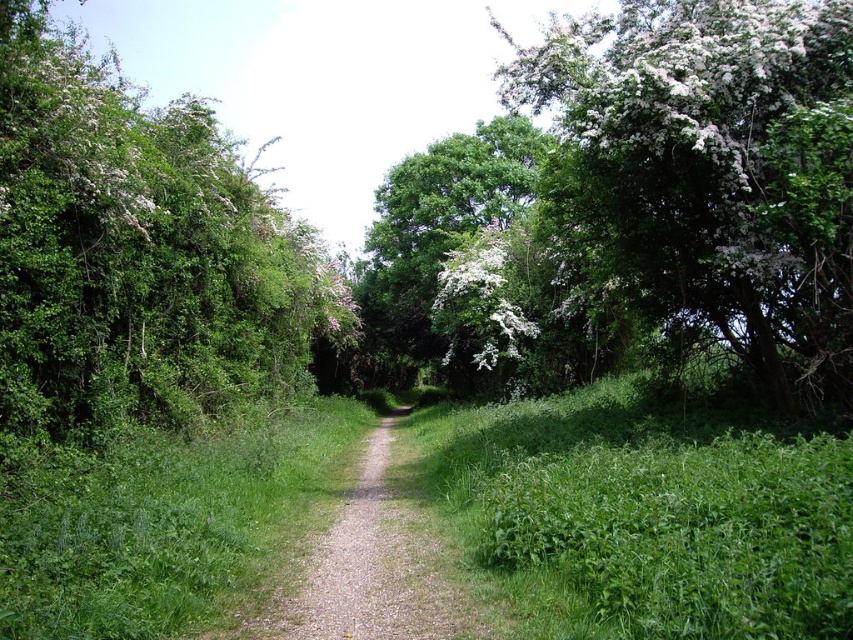
Does gravel path at center have a smaller size compared to green leafy tree at center?

Correct, gravel path at center occupies less space than green leafy tree at center.

Between gravel path at center and green leafy tree at center, which one appears on the right side from the viewer's perspective?

Positioned to the right is gravel path at center.

Image resolution: width=853 pixels, height=640 pixels. Identify the location of gravel path at center. (370, 568).

Does white blossoming tree at upper right have a larger size compared to green leafy grass at center?

Yes, white blossoming tree at upper right is bigger than green leafy grass at center.

Is point (717, 97) farther from viewer compared to point (593, 444)?

No, (717, 97) is in front of (593, 444).

This screenshot has width=853, height=640. What are the coordinates of `white blossoming tree at upper right` in the screenshot? It's located at pos(714,172).

Does white blossoming tree at upper right lie behind green leafy tree at center?

No, it is not.

The image size is (853, 640). I want to click on white blossoming tree at upper right, so click(714, 172).

Between point (740, 342) and point (427, 339), which one is positioned behind?

The point (427, 339) is behind.

Find the location of a particular element. The width and height of the screenshot is (853, 640). white blossoming tree at upper right is located at coordinates (714, 172).